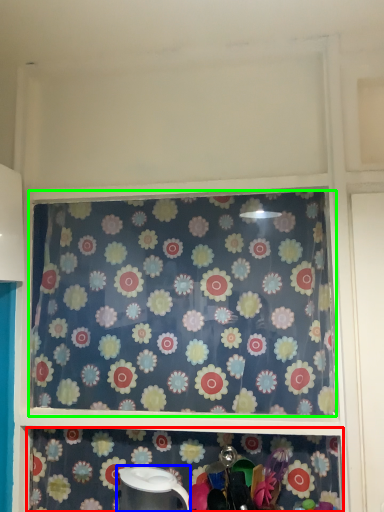
Question: Considering the real-world distances, which object is farthest from shelf (highlighted by a red box)? appliance (highlighted by a blue box) or curtain (highlighted by a green box)?

Choices:
 (A) appliance
 (B) curtain

Answer: (B)